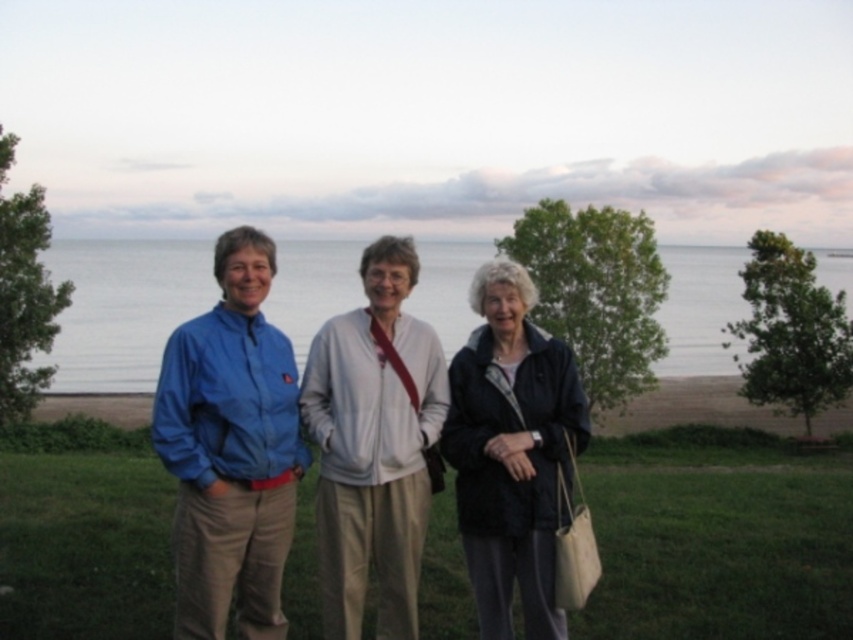
In the image, there are three people standing on a grassy area near a body of water. The blue fabric jacket at center is represented by point (299, 445). Which person is wearing the blue fabric jacket at center?

The blue fabric jacket at center is worn by the person at the point (299, 445).

You are a photographer setting up a tripod to capture the three people in the scene. You need to ensure that both the blue fabric jacket at center and the blue fabric jacket at left are fully visible in the frame. Based on their sizes, which jacket might require you to adjust the camera angle to accommodate its width?

The blue fabric jacket at center might be wider than the blue fabric jacket at left, so you might need to adjust the camera angle to ensure it fits within the frame.